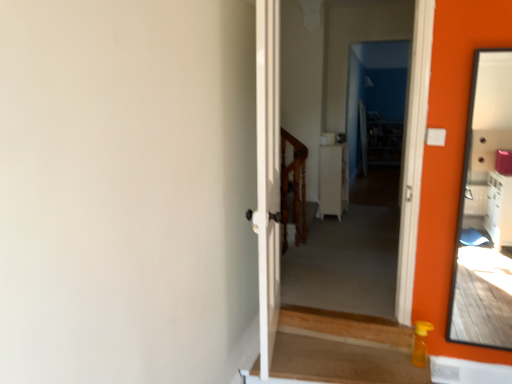
Locate an element on the screen. This screenshot has width=512, height=384. vacant area that lies to the right of white glossy cabinet at center is located at coordinates (366, 218).